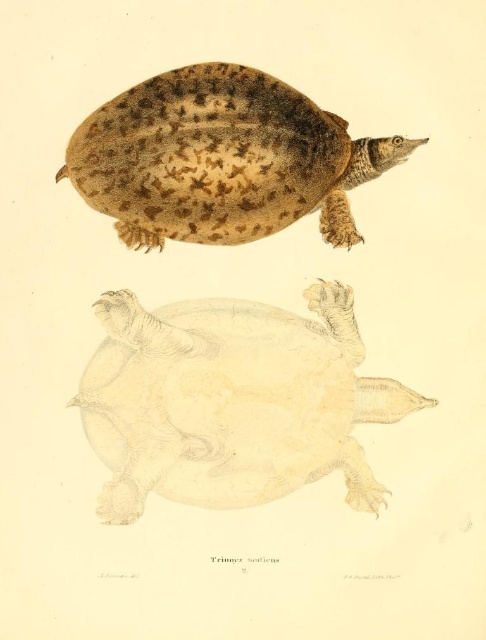
You are an animal researcher examining the turtle illustration. You notice the beige textured shell at center and the brown textured shell at upper center. Which shell is located more to the right in the image?

The beige textured shell at center is positioned on the right side of the brown textured shell at upper center, so it is more to the right.

You are an artist trying to draw the turtle species Trionyx muticus based on the provided illustration. You need to ensure the spacing between the beige textured shell at center and the brown textured shell at upper center is accurate. What is the exact distance you should leave between them?

The exact distance between the beige textured shell at center and the brown textured shell at upper center should be 9.62 inches, as specified in the illustration.